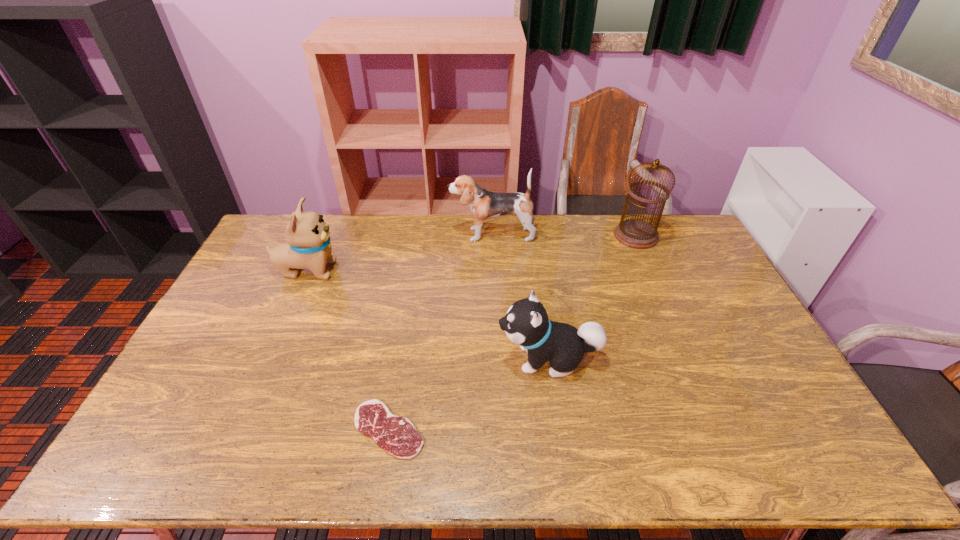
You are a GUI agent. You are given a task and a screenshot of the screen. Output one action in this format:
    pyautogui.click(x=<x>, y=<y>)
    Task: Click on the vacant space located at the face of the farthest puppy
    This screenshot has width=960, height=540.
    Given the screenshot: What is the action you would take?
    pyautogui.click(x=411, y=234)

The height and width of the screenshot is (540, 960). Identify the location of free region located at the face of the farthest puppy. (408, 234).

Identify the location of vacant region located 0.140m on the face of the third farthest object. (380, 270).

Where is `free point located at the face of the nearest puppy`? This screenshot has width=960, height=540. free point located at the face of the nearest puppy is located at coordinates (472, 359).

Locate an element on the screen. The image size is (960, 540). blank space located 0.150m at the face of the nearest puppy is located at coordinates (444, 359).

Identify the location of free space located at the face of the nearest puppy. The image size is (960, 540). (444, 359).

Locate an element on the screen. The height and width of the screenshot is (540, 960). free spot located 0.390m on the right of the nearest object is located at coordinates (582, 429).

I want to click on birdcage that is positioned at the far edge, so click(x=638, y=234).

Find the location of a particular element. The height and width of the screenshot is (540, 960). puppy present at the far edge is located at coordinates (484, 204).

This screenshot has height=540, width=960. Identify the location of object that is at the near edge. (397, 435).